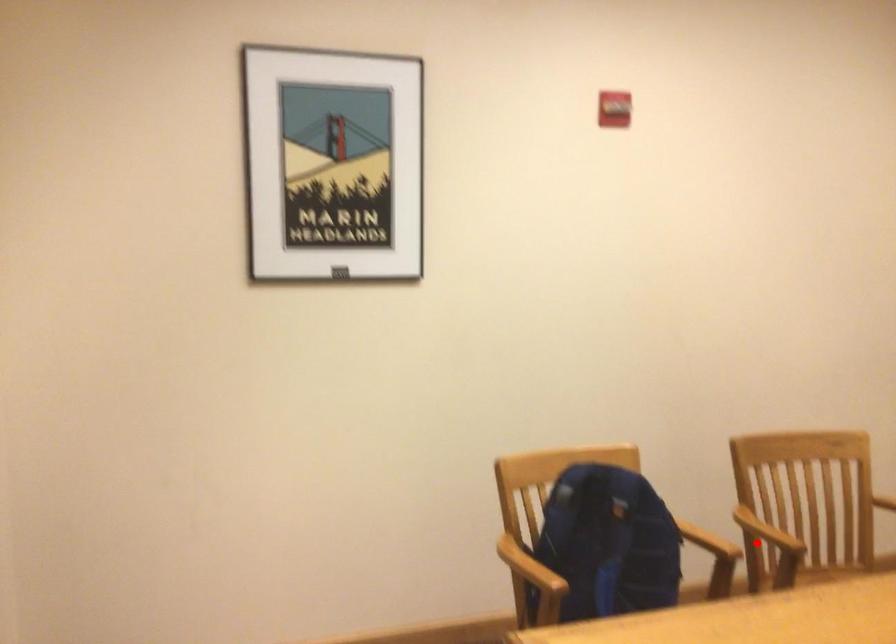
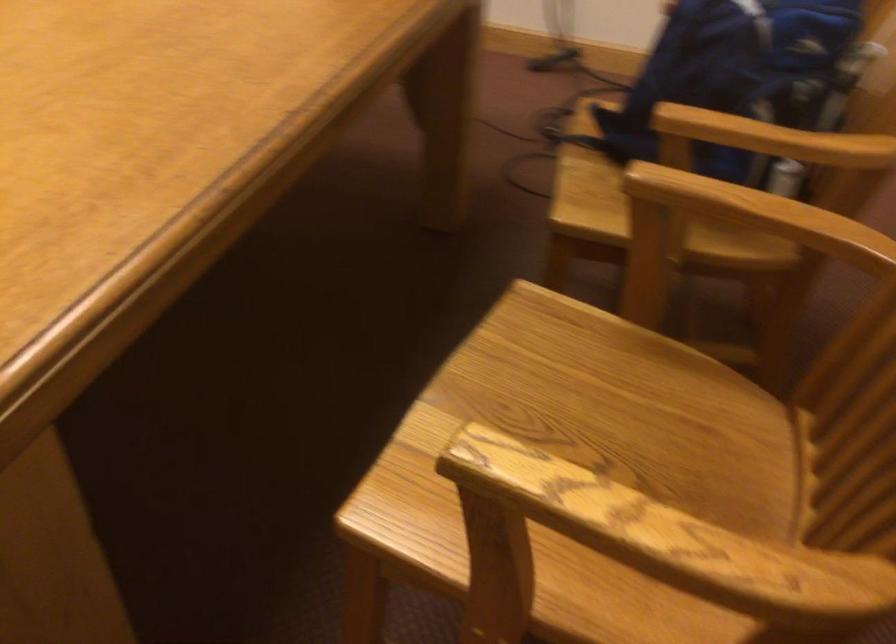
In the second image, find the point that corresponds to the highlighted location in the first image.

(743, 223)